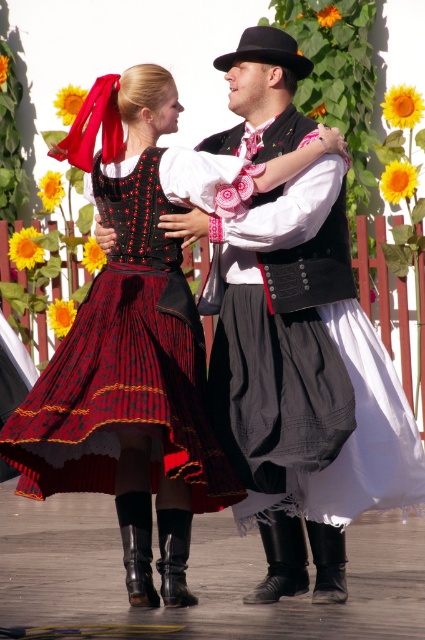
You are a costume designer examining the traditional folk costumes in the image. The woman on the left has two key components in her outfit labeled as the matte black skirt at center and the black velvet vest at center. Based on their arrangement, which one is covering the other?

The matte black skirt at center is positioned over the black velvet vest at center, so the skirt is covering the vest.

You are a costume designer preparing for a performance. You have two skirts in the center of your workspace, a matte black skirt at center and a rich burgundy velvet skirt at center. You need to choose the larger one for a dance routine. Which skirt should you select?

The matte black skirt at center is bigger than the rich burgundy velvet skirt at center, so you should select the matte black skirt at center for the dance routine.